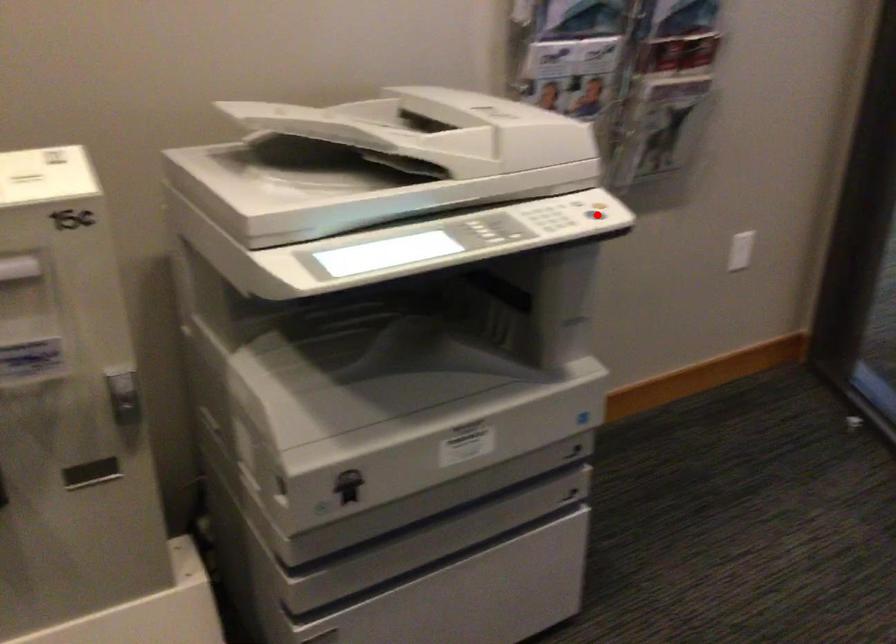
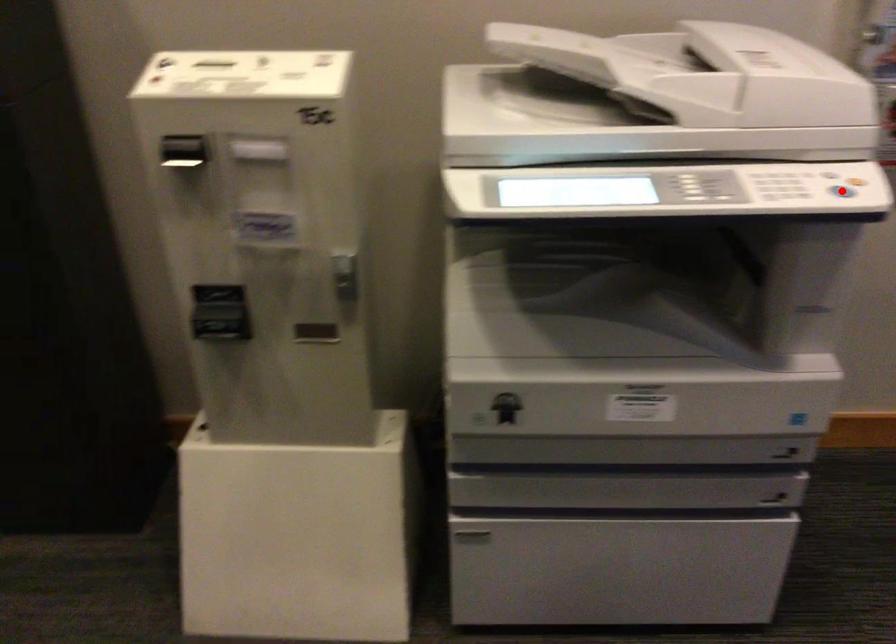
I am providing you with two images of the same scene from different viewpoints. A red point is marked on the first image and another point is marked on the second image. Is the red point in image1 aligned with the point shown in image2?

Yes